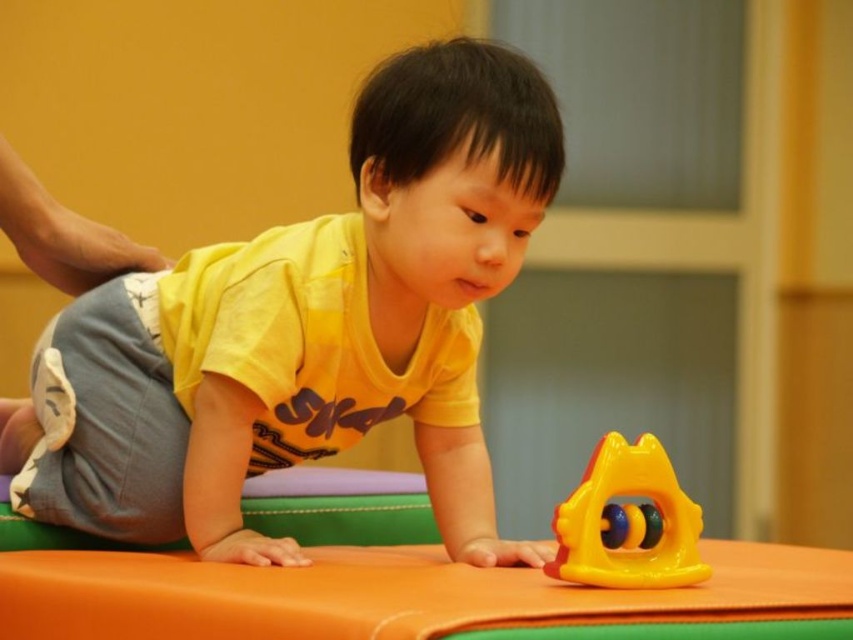
A child is playing with a toy. The child is at point (393, 400). The toy is 4.64 feet away. If the child crawls forward, will they reach the toy before moving 5 feet?

Yes, because the distance between them is 4.64 feet, which is less than 5 feet, so the child will reach the toy before crawling 5 feet.

You are a parent observing your child playing. You notice the yellow matte shirt at center and the rubberized yellow and orange toy at center. Which object is closer to the top of the image?

The yellow matte shirt at center is located above the rubberized yellow and orange toy at center, so it is closer to the top of the image.

You are a photographer trying to capture the child in the scene. The yellow matte shirt at center and the rubberized yellow and orange toy at center are both in focus. Which object will appear bigger in the photo?

The yellow matte shirt at center will appear bigger in the photo because it is larger in size than the rubberized yellow and orange toy at center.